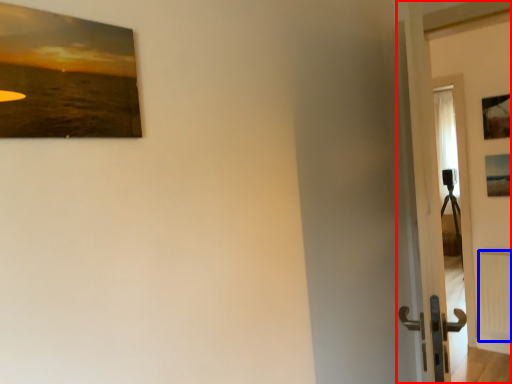
Question: Which object appears farthest to the camera in this image, door (highlighted by a red box) or radiator (highlighted by a blue box)?

Choices:
 (A) door
 (B) radiator

Answer: (B)